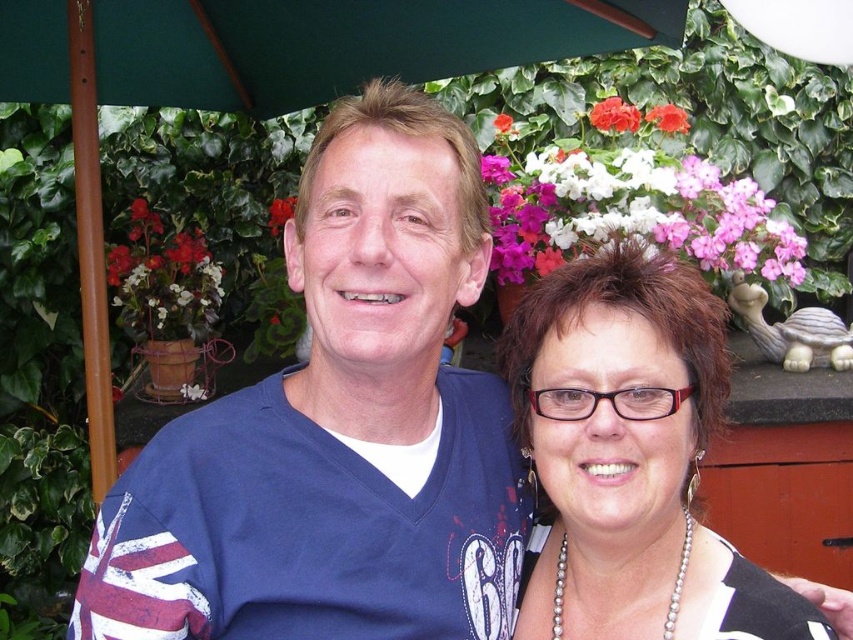
From the picture: Can you confirm if pearl necklace at center is taller than matte red flower at upper left?

Yes, pearl necklace at center is taller than matte red flower at upper left.

Locate an element on the screen. Image resolution: width=853 pixels, height=640 pixels. pearl necklace at center is located at coordinates (630, 456).

Image resolution: width=853 pixels, height=640 pixels. Describe the element at coordinates (631, 211) in the screenshot. I see `pink matte flowers at upper center` at that location.

Find the location of a particular element. pink matte flowers at upper center is located at coordinates (x=631, y=211).

The height and width of the screenshot is (640, 853). I want to click on pink matte flowers at upper center, so click(x=631, y=211).

Who is higher up, matte red flower at upper left or pink matte flower at upper center?

Positioned higher is pink matte flower at upper center.

Does matte red flower at upper left have a greater width compared to pink matte flower at upper center?

Yes.

At what (x,y) coordinates should I click in order to perform the action: click on matte red flower at upper left. Please return your answer as a coordinate pair (x, y). Looking at the image, I should click on (163, 280).

Find the location of a particular element. The height and width of the screenshot is (640, 853). matte red flower at upper left is located at coordinates (163, 280).